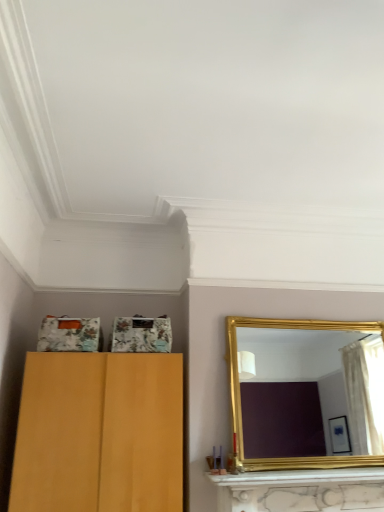
Question: From a real-world perspective, relative to gold-framed mirror at right, is gold metallic mantle at lower center vertically above or below?

Choices:
 (A) above
 (B) below

Answer: (B)

Question: Considering their positions, is gold metallic mantle at lower center located in front of or behind gold-framed mirror at right?

Choices:
 (A) front
 (B) behind

Answer: (A)

Question: From the image's perspective, relative to gold-framed mirror at right, is gold metallic mantle at lower center above or below?

Choices:
 (A) below
 (B) above

Answer: (A)

Question: Would you say gold-framed mirror at right is inside or outside gold metallic mantle at lower center?

Choices:
 (A) inside
 (B) outside

Answer: (B)

Question: Is gold-framed mirror at right to the left or to the right of gold metallic mantle at lower center in the image?

Choices:
 (A) left
 (B) right

Answer: (B)

Question: Is gold-framed mirror at right taller or shorter than gold metallic mantle at lower center?

Choices:
 (A) short
 (B) tall

Answer: (B)

Question: From the image's perspective, is gold-framed mirror at right above or below gold metallic mantle at lower center?

Choices:
 (A) above
 (B) below

Answer: (A)